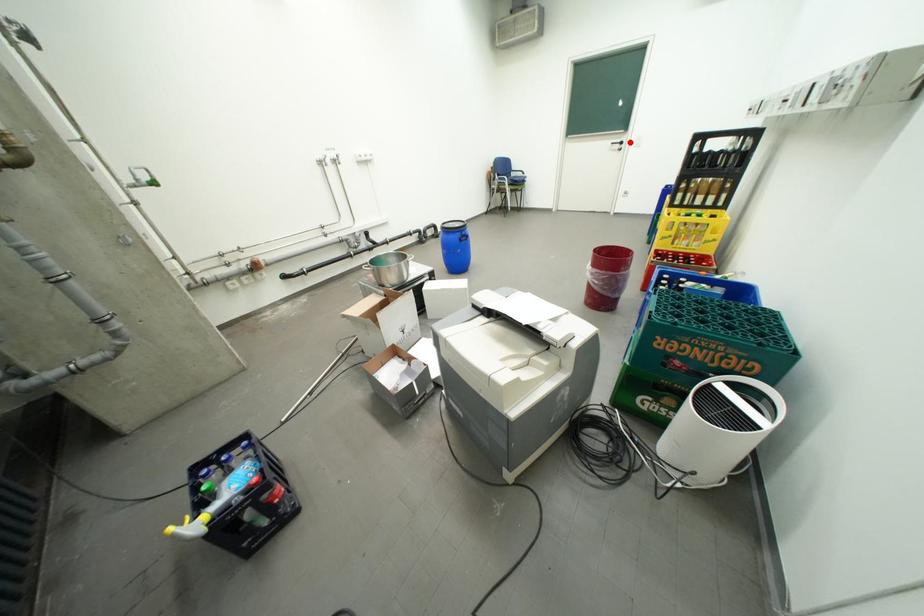
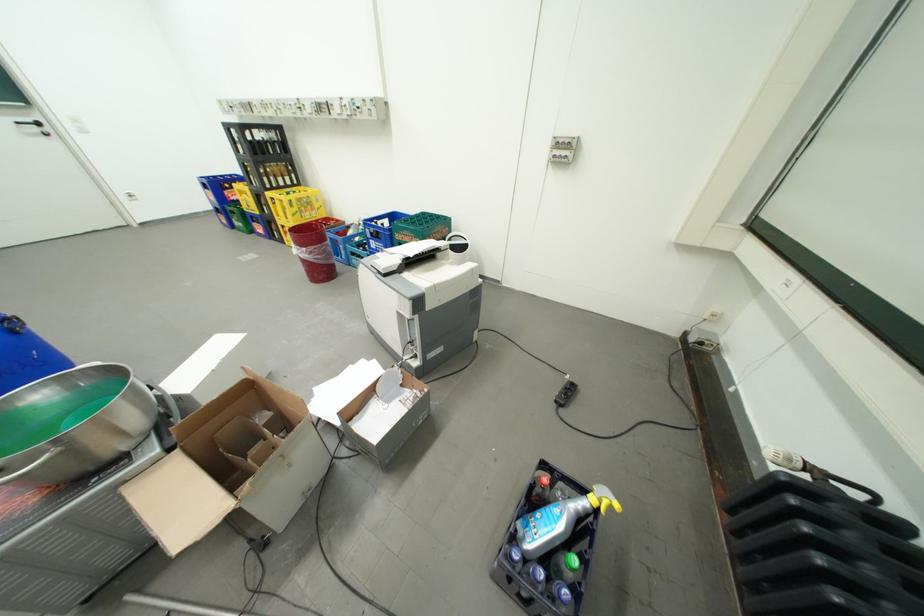
Find the pixel in the second image that matches the highlighted location in the first image.

(41, 122)